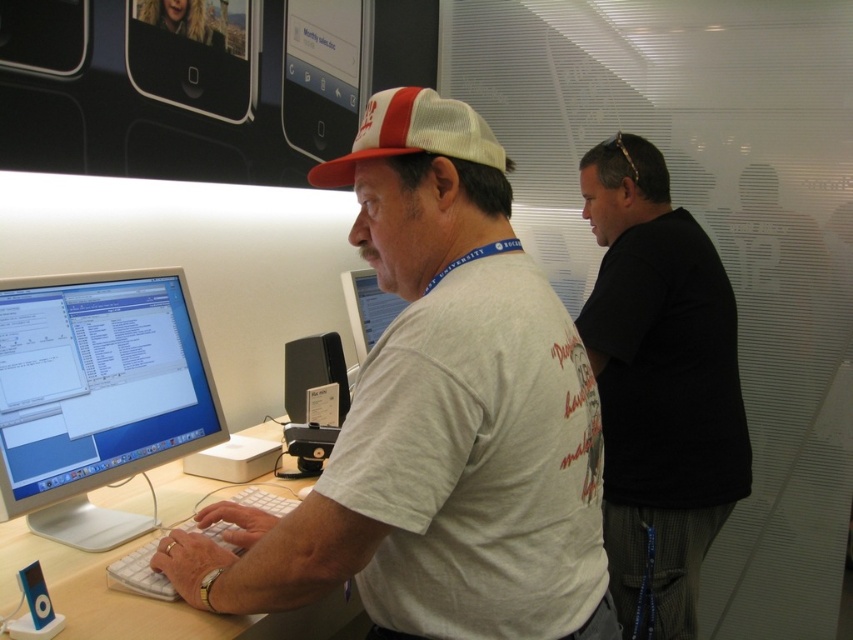
Does white mesh baseball cap at center have a greater height compared to black plastic speaker at center?

No.

Can you confirm if white mesh baseball cap at center is wider than black plastic speaker at center?

Correct, the width of white mesh baseball cap at center exceeds that of black plastic speaker at center.

Is point (363, 154) positioned in front of point (317, 432)?

That is True.

The width and height of the screenshot is (853, 640). Find the location of `white mesh baseball cap at center`. white mesh baseball cap at center is located at coordinates (413, 134).

Does point (323, 598) come in front of point (328, 387)?

That is True.

Identify the location of white plastic table at center. (143, 600).

Who is positioned more to the left, black plastic speaker at center or matte white monitor at center?

black plastic speaker at center

Can you confirm if black plastic speaker at center is positioned to the left of matte white monitor at center?

Yes, black plastic speaker at center is to the left of matte white monitor at center.

Which is in front, point (299, 378) or point (384, 304)?

Point (299, 378)

The width and height of the screenshot is (853, 640). Identify the location of black plastic speaker at center. (306, 397).